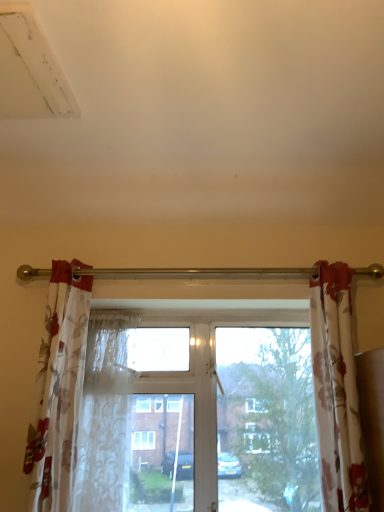
Question: Do you think translucent floral fabric at center is within transparent glass window at center, or outside of it?

Choices:
 (A) inside
 (B) outside

Answer: (A)

Question: From the image's perspective, is translucent floral fabric at center above or below transparent glass window at center?

Choices:
 (A) above
 (B) below

Answer: (A)

Question: Estimate the real-world distances between objects in this image. Which object is farther from the translucent floral fabric at center?

Choices:
 (A) transparent glass window at center
 (B) floral fabric curtain at right, the 2th curtain when ordered from left to right
 (C) floral sheer curtain at left, marked as the first curtain in a left-to-right arrangement

Answer: (B)

Question: Which of these objects is positioned closest to the floral sheer curtain at left, the second curtain in the right-to-left sequence?

Choices:
 (A) transparent glass window at center
 (B) floral fabric curtain at right, the 2th curtain when ordered from left to right
 (C) translucent floral fabric at center

Answer: (A)